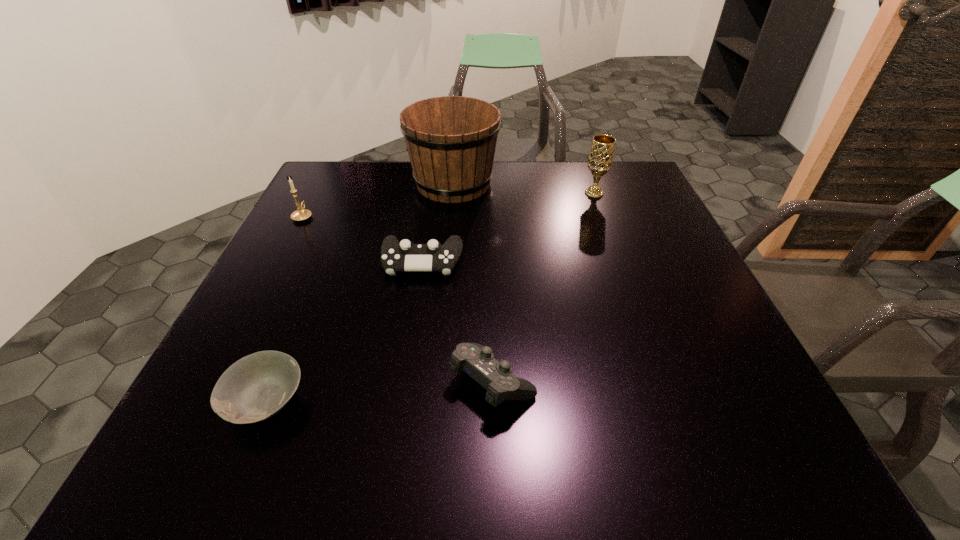
Identify the location of vacant region located 0.340m on the front of the chalice. This screenshot has width=960, height=540. (626, 281).

Locate an element on the screen. Image resolution: width=960 pixels, height=540 pixels. vacant space positioned on the handle side of the third tallest object is located at coordinates (329, 167).

Where is `vacant position located 0.050m on the handle side of the third tallest object`? The image size is (960, 540). vacant position located 0.050m on the handle side of the third tallest object is located at coordinates (312, 199).

The height and width of the screenshot is (540, 960). Identify the location of free space located 0.180m on the handle side of the third tallest object. (324, 177).

Locate an element on the screen. The height and width of the screenshot is (540, 960). vacant space located 0.130m on the back of the nearer control is located at coordinates (491, 301).

In order to click on free space located 0.380m on the surface of the farther control in this screenshot , I will do `click(395, 440)`.

You are a GUI agent. You are given a task and a screenshot of the screen. Output one action in this format:
    pyautogui.click(x=<x>, y=<y>)
    Task: Click on the vacant area situated 0.110m on the back of the second object from left to right
    
    Given the screenshot: What is the action you would take?
    pyautogui.click(x=298, y=323)

Where is `wine bucket located in the far edge section of the desktop`? wine bucket located in the far edge section of the desktop is located at coordinates (451, 141).

Find the location of a particular element. This screenshot has height=540, width=960. chalice that is at the far edge is located at coordinates (600, 159).

The height and width of the screenshot is (540, 960). In order to click on object that is positioned at the near edge in this screenshot , I will do `click(256, 387)`.